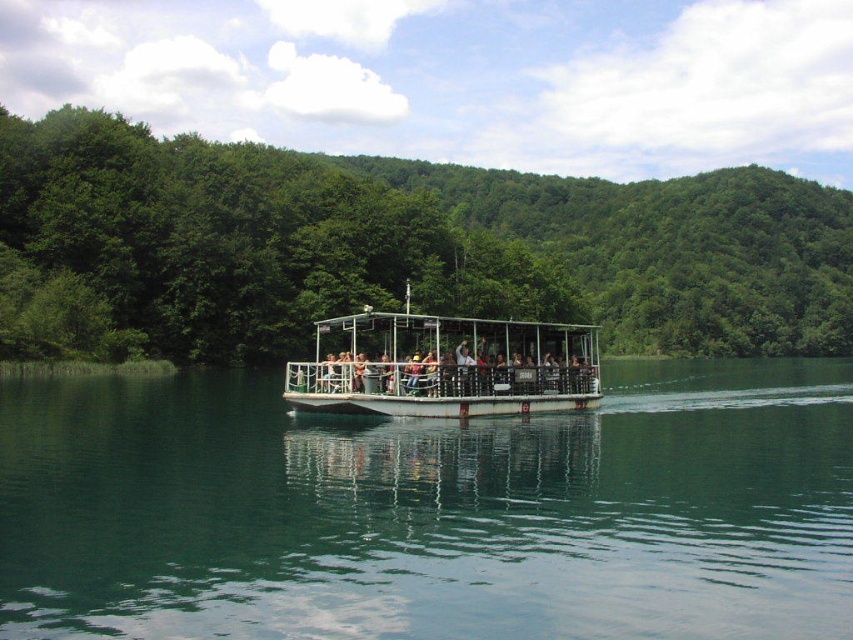
Question: Which point is closer to the camera taking this photo?

Choices:
 (A) (436, 396)
 (B) (189, 417)
 (C) (791, 216)
 (D) (558, 384)

Answer: (A)

Question: Where is green leafy trees at center located in relation to white metal boat at center in the image?

Choices:
 (A) right
 (B) left

Answer: (A)

Question: Based on their relative distances, which object is farther from the matte black boat at center?

Choices:
 (A) green leafy trees at center
 (B) white metal boat at center

Answer: (A)

Question: Estimate the real-world distances between objects in this image. Which object is farther from the white metal boat at center?

Choices:
 (A) matte black boat at center
 (B) green glassy water at center

Answer: (B)

Question: Does green glassy water at center appear on the left side of white metal boat at center?

Choices:
 (A) no
 (B) yes

Answer: (A)

Question: Can you confirm if green leafy trees at center is bigger than matte black boat at center?

Choices:
 (A) no
 (B) yes

Answer: (B)